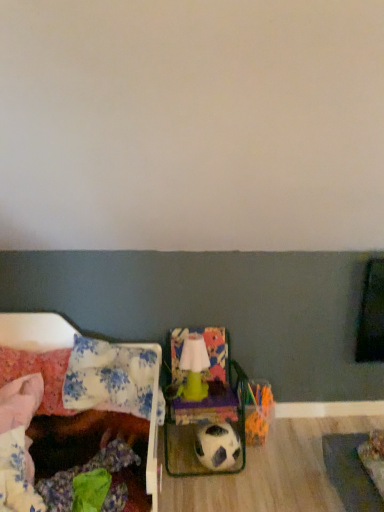
Where is `blank space to the left of black and white textured football at center`? Image resolution: width=384 pixels, height=512 pixels. blank space to the left of black and white textured football at center is located at coordinates (181, 477).